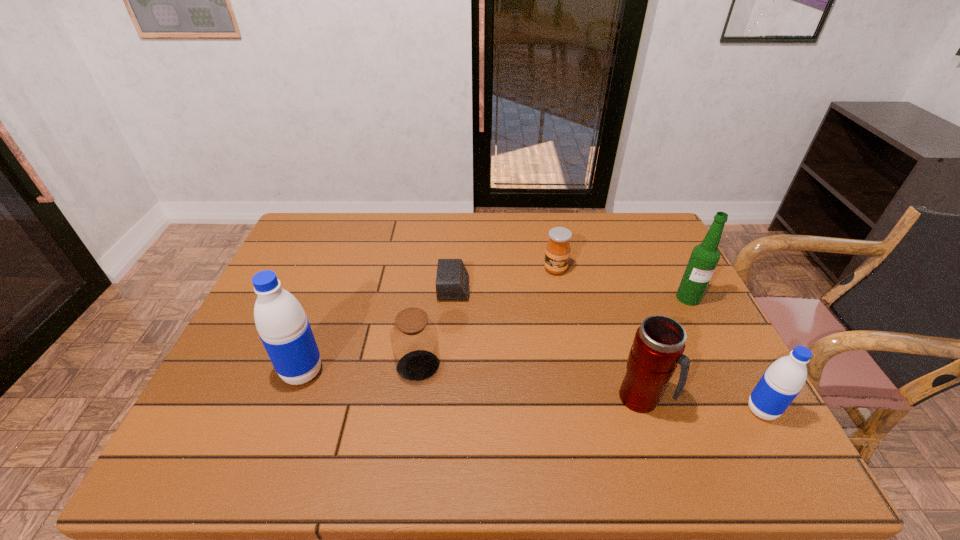
Identify the location of object that can be found as the sixth closest to the fifth object from left to right. Image resolution: width=960 pixels, height=540 pixels. (284, 329).

This screenshot has width=960, height=540. I want to click on free space in the image that satisfies the following two spatial constraints: 1. on the label of the beer bottle; 2. on the left side of the right water bottle, so click(746, 410).

The image size is (960, 540). Identify the location of vacant space that satisfies the following two spatial constraints: 1. on the side with the handle of the fifth object from left to right; 2. on the back side of the shorter water bottle. (645, 410).